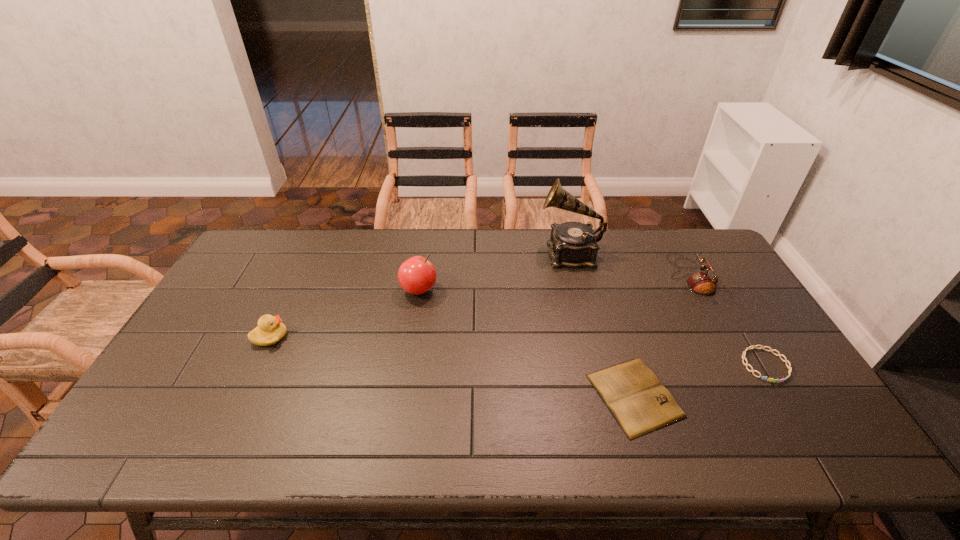
Where is `phonograph record`? phonograph record is located at coordinates (572, 244).

Image resolution: width=960 pixels, height=540 pixels. What are the coordinates of `apple` in the screenshot? It's located at (416, 275).

I want to click on the second tallest object, so 416,275.

I want to click on telephone, so click(x=701, y=283).

You are a GUI agent. You are given a task and a screenshot of the screen. Output one action in this format:
    pyautogui.click(x=<x>, y=<y>)
    Task: Click on the duckling
    The height and width of the screenshot is (540, 960).
    Given the screenshot: What is the action you would take?
    pyautogui.click(x=270, y=330)

At what (x,y) coordinates should I click in order to perform the action: click on the third shortest object. Please return your answer as a coordinate pair (x, y). This screenshot has height=540, width=960. Looking at the image, I should click on (270, 330).

At what (x,y) coordinates should I click in order to perform the action: click on bracelet. Please return your answer as a coordinate pair (x, y). Image resolution: width=960 pixels, height=540 pixels. Looking at the image, I should click on (786, 361).

You are a GUI agent. You are given a task and a screenshot of the screen. Output one action in this format:
    pyautogui.click(x=<x>, y=<y>)
    Task: Click on the book
    This screenshot has width=960, height=540.
    Given the screenshot: What is the action you would take?
    pyautogui.click(x=639, y=402)

The height and width of the screenshot is (540, 960). I want to click on free space located 0.170m on the horn of the tallest object, so click(490, 253).

Identify the location of free space located on the horn of the tallest object. The width and height of the screenshot is (960, 540). (427, 253).